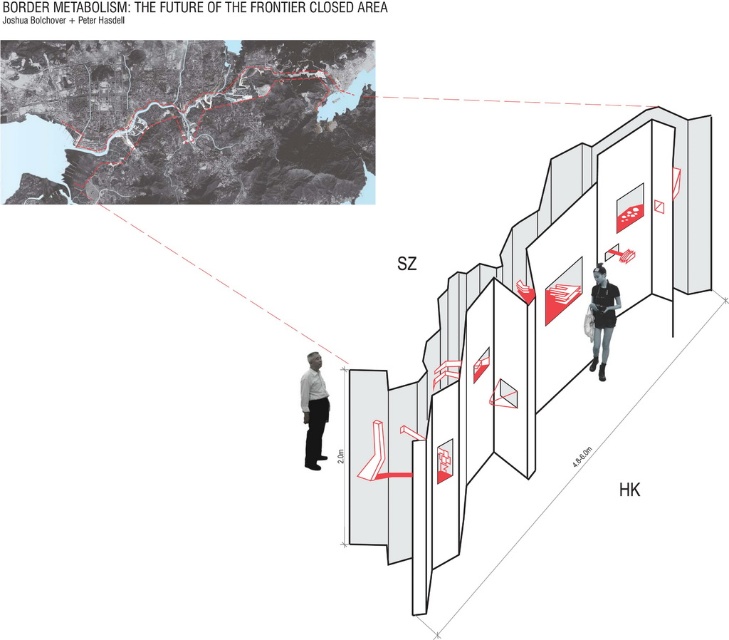
You are an observer standing in the scene. Which object takes up more space, the white matte shirt at lower left or the black matte shirt at center?

The black matte shirt at center occupies more space than the white matte shirt at lower left.

You are a designer looking at the architectural visualization. You need to determine the spatial relationship between the white matte shirt at lower left and the black matte shirt at center. Which shirt is placed below the other?

The white matte shirt at lower left is positioned under the black matte shirt at center, so it is placed below the other.

You are standing at the midpoint between point (319, 371) and point (604, 320) in the image. Which point will appear closer to you?

Point (319, 371) is further to the viewer than point (604, 320), so when standing at the midpoint, point (319, 371) will appear closer to you.